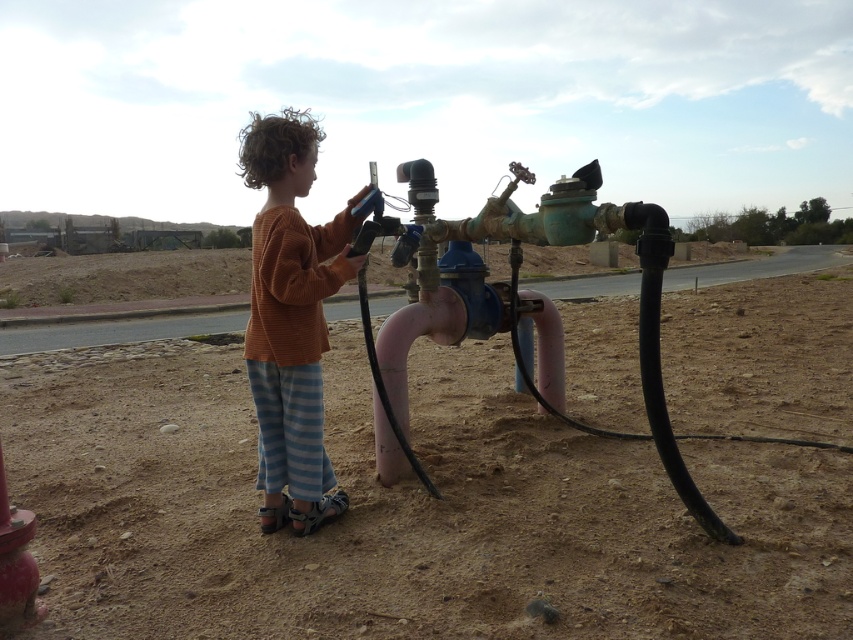
Is greenish-brown metallic water pipe at center further to camera compared to matte red hydrant at lower left?

That is True.

Is greenish-brown metallic water pipe at center taller than matte red hydrant at lower left?

Correct, greenish-brown metallic water pipe at center is much taller as matte red hydrant at lower left.

Does point (500, 236) lie behind point (27, 556)?

Yes, it is.

You are a GUI agent. You are given a task and a screenshot of the screen. Output one action in this format:
    pyautogui.click(x=<x>, y=<y>)
    Task: Click on the greenish-brown metallic water pipe at center
    
    Given the screenshot: What is the action you would take?
    pyautogui.click(x=532, y=243)

Between dull brown dirt at center and matte red hydrant at lower left, which one has more height?

Standing taller between the two is dull brown dirt at center.

Does point (285, 557) come behind point (9, 524)?

Yes, it is.

Find the location of a particular element. Image resolution: width=853 pixels, height=640 pixels. dull brown dirt at center is located at coordinates [401, 509].

Is point (260, 272) less distant than point (15, 566)?

That is False.

This screenshot has height=640, width=853. In order to click on brown sweater at center in this screenshot , I will do `click(291, 320)`.

Is point (312, 259) farther from camera compared to point (13, 604)?

That is True.

The height and width of the screenshot is (640, 853). I want to click on brown sweater at center, so click(291, 320).